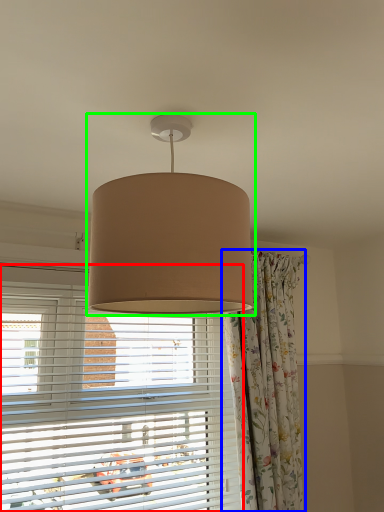
Question: Which object is positioned closest to window blind (highlighted by a red box)? Select from curtain (highlighted by a blue box) and lamp (highlighted by a green box).

Choices:
 (A) curtain
 (B) lamp

Answer: (A)